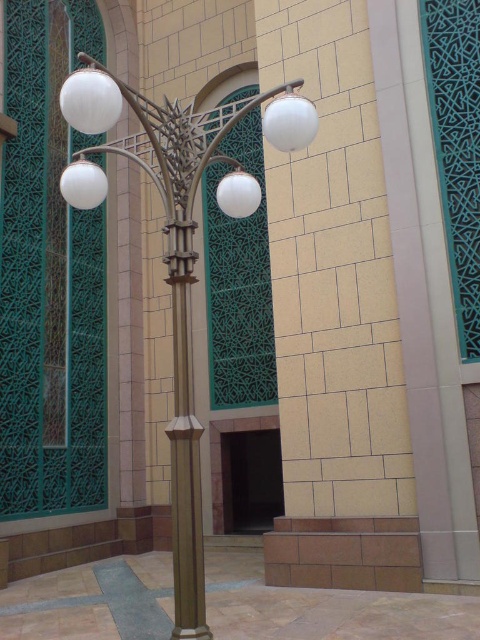
You are standing in front of the metallic gold streetlight at center and want to take a photo of it with your smartphone, which has a maximum focus range of 10 feet. Will the streetlight be in focus?

The metallic gold streetlight at center is 9.38 feet from camera, which is within the smartphone camera maximum focus range of 10 feet. Therefore, the streetlight will be in focus.

You are standing at the center of the courtyard and see two points marked on the ground. The first point is at coordinates point (236,160) and the second is at point (172,333). If you want to walk towards the point that is closer to the decorative streetlamp, which coordinate should you head towards?

Point (172,333) is closer to the decorative streetlamp because point (236,160) is behind it according to their positions.